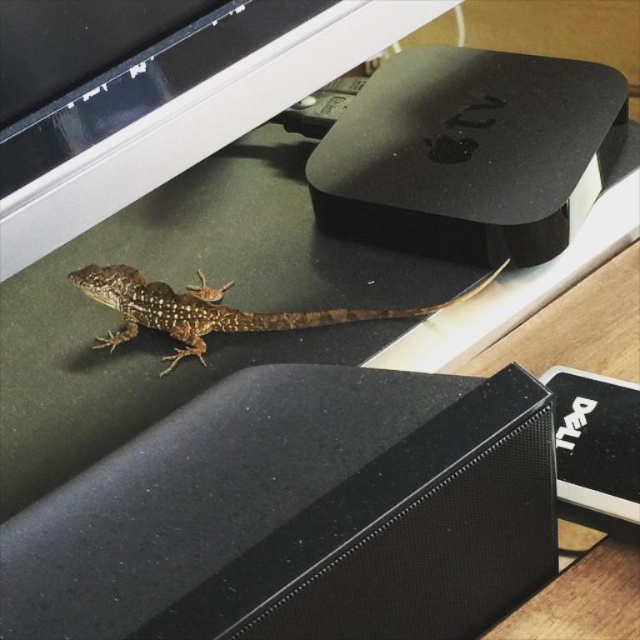
Question: Where is black matte speaker at lower center located in relation to brown scaly lizard at lower left in the image?

Choices:
 (A) left
 (B) right

Answer: (B)

Question: Is black matte speaker at lower center positioned behind brown scaly lizard at lower left?

Choices:
 (A) yes
 (B) no

Answer: (B)

Question: Which of the following is the closest to the observer?

Choices:
 (A) brown scaly lizard at lower left
 (B) black matte speaker at lower center

Answer: (B)

Question: Can you confirm if black matte speaker at lower center is bigger than brown scaly lizard at lower left?

Choices:
 (A) yes
 (B) no

Answer: (A)

Question: Which object is closer to the camera taking this photo?

Choices:
 (A) black matte speaker at lower center
 (B) brown scaly lizard at lower left

Answer: (A)